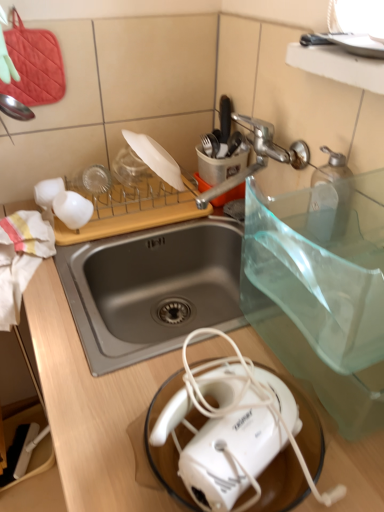
Question: Does white matte plate at upper center turn towards silver metallic faucet at upper center?

Choices:
 (A) yes
 (B) no

Answer: (A)

Question: Is white matte plate at upper center wider than silver metallic faucet at upper center?

Choices:
 (A) yes
 (B) no

Answer: (B)

Question: Is white matte plate at upper center in front of silver metallic faucet at upper center?

Choices:
 (A) no
 (B) yes

Answer: (A)

Question: Considering the relative sizes of white matte plate at upper center and silver metallic faucet at upper center in the image provided, is white matte plate at upper center bigger than silver metallic faucet at upper center?

Choices:
 (A) no
 (B) yes

Answer: (A)

Question: From a real-world perspective, is white matte plate at upper center below silver metallic faucet at upper center?

Choices:
 (A) yes
 (B) no

Answer: (A)

Question: Would you say white matte plate at upper center is outside silver metallic faucet at upper center?

Choices:
 (A) yes
 (B) no

Answer: (A)

Question: Is white wood cutting board at upper center smaller than silver metallic faucet at upper center?

Choices:
 (A) no
 (B) yes

Answer: (A)

Question: From the image's perspective, is white wood cutting board at upper center located beneath silver metallic faucet at upper center?

Choices:
 (A) yes
 (B) no

Answer: (A)

Question: Is white wood cutting board at upper center further to the viewer compared to silver metallic faucet at upper center?

Choices:
 (A) yes
 (B) no

Answer: (A)

Question: Would you say silver metallic faucet at upper center is part of white wood cutting board at upper center's contents?

Choices:
 (A) no
 (B) yes

Answer: (A)

Question: Is white wood cutting board at upper center thinner than silver metallic faucet at upper center?

Choices:
 (A) no
 (B) yes

Answer: (B)

Question: Are white wood cutting board at upper center and silver metallic faucet at upper center beside each other?

Choices:
 (A) yes
 (B) no

Answer: (B)

Question: From a real-world perspective, is white matte coffee cup at upper left positioned under white plastic toaster at lower center based on gravity?

Choices:
 (A) yes
 (B) no

Answer: (A)